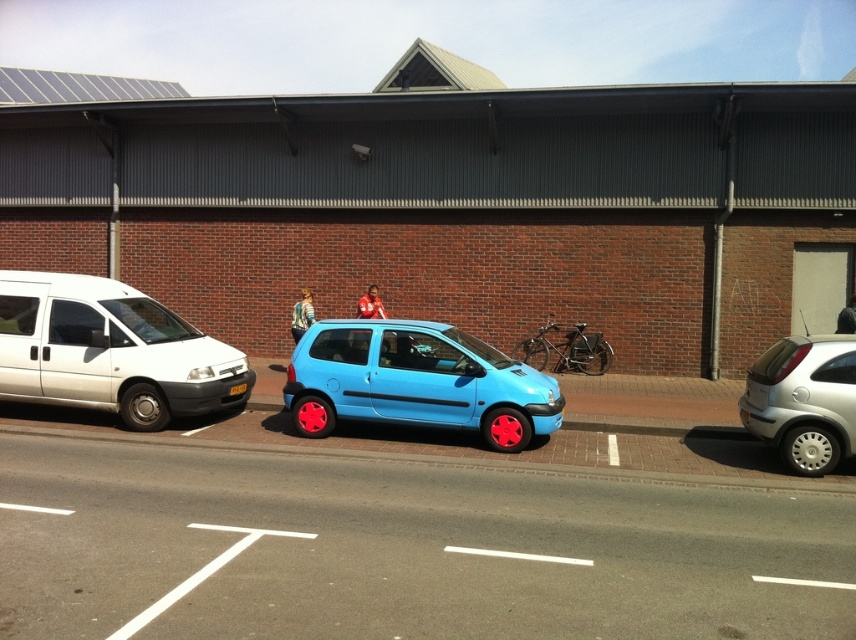
Which of these two, matte blue hatchback at center or black plastic license plate at center, stands shorter?

black plastic license plate at center is shorter.

Who is more distant from viewer, (391, 412) or (230, 392)?

Point (230, 392)

Image resolution: width=856 pixels, height=640 pixels. In order to click on matte blue hatchback at center in this screenshot , I will do click(415, 381).

Between point (829, 397) and point (238, 394), which one is positioned in front?

Positioned in front is point (829, 397).

Can you confirm if silver metallic hatchback at right is taller than black plastic license plate at center?

Indeed, silver metallic hatchback at right has a greater height compared to black plastic license plate at center.

The height and width of the screenshot is (640, 856). In order to click on silver metallic hatchback at right in this screenshot , I will do `click(803, 401)`.

Is white matte van at left to the right of matte blue hatchback at center from the viewer's perspective?

In fact, white matte van at left is to the left of matte blue hatchback at center.

Between white matte van at left and matte blue hatchback at center, which one has less height?

Standing shorter between the two is matte blue hatchback at center.

Who is more distant from viewer, [158,314] or [547,433]?

Point [158,314]

Identify the location of white matte van at left. (110, 349).